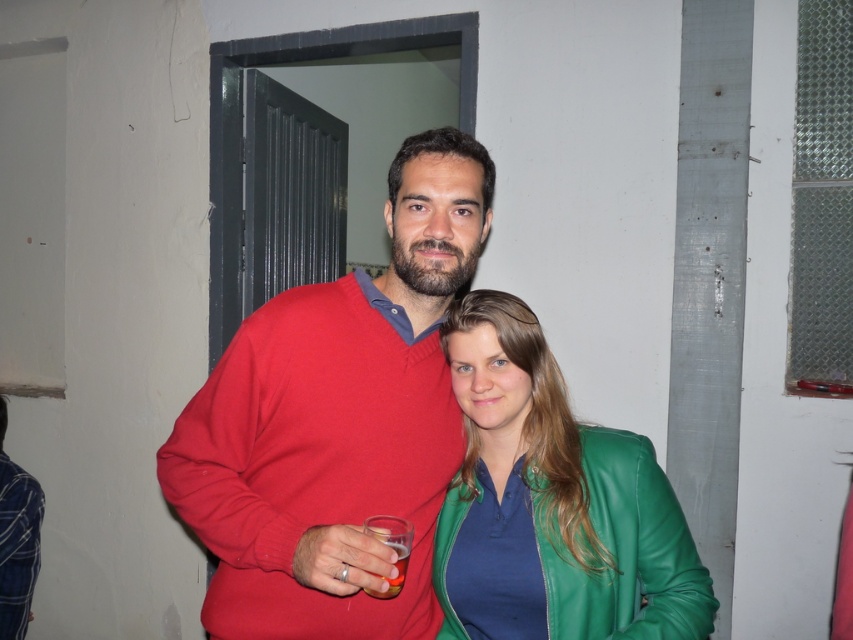
Can you confirm if matte red sweater at center is wider than translucent plastic cup at center?

Yes, matte red sweater at center is wider than translucent plastic cup at center.

Find the location of `matte red sweater at center`. matte red sweater at center is located at coordinates (337, 422).

Is point (444, 362) in front of point (396, 579)?

No.

Locate an element on the screen. The height and width of the screenshot is (640, 853). matte red sweater at center is located at coordinates (337, 422).

Does green leather jacket at center have a greater width compared to translucent plastic cup at center?

Yes, green leather jacket at center is wider than translucent plastic cup at center.

Who is more forward, (x=547, y=456) or (x=404, y=536)?

Point (x=404, y=536)

Locate an element on the screen. Image resolution: width=853 pixels, height=640 pixels. green leather jacket at center is located at coordinates (558, 513).

Who is shorter, matte red sweater at center or green leather jacket at center?

green leather jacket at center

Is matte red sweater at center thinner than green leather jacket at center?

No, matte red sweater at center is not thinner than green leather jacket at center.

You are a GUI agent. You are given a task and a screenshot of the screen. Output one action in this format:
    pyautogui.click(x=<x>, y=<y>)
    Task: Click on the matte red sweater at center
    The height and width of the screenshot is (640, 853).
    Given the screenshot: What is the action you would take?
    pyautogui.click(x=337, y=422)

Identify the location of matte red sweater at center. (337, 422).